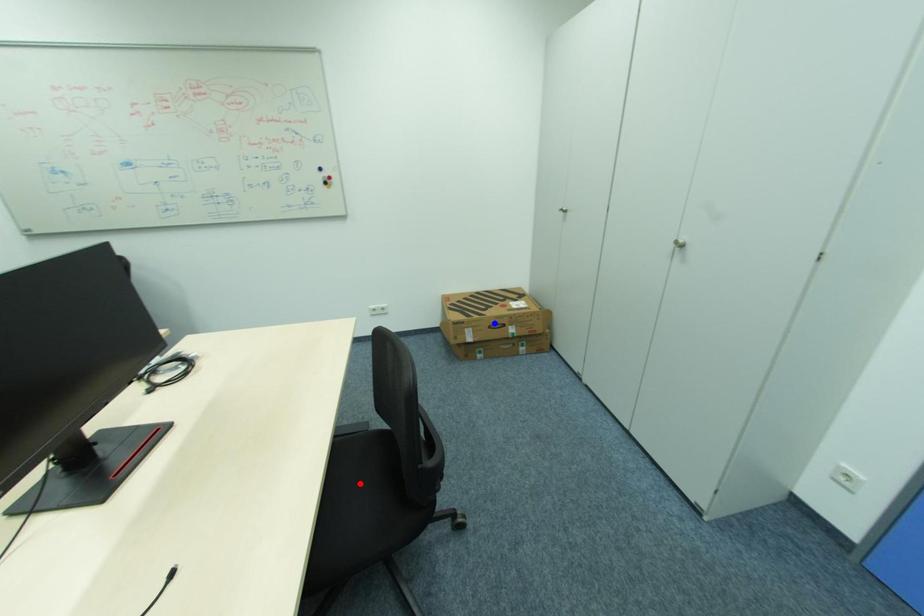
Question: In the image, two points are highlighted. Which point is nearer to the camera? Reply with the corresponding letter.

Choices:
 (A) blue point
 (B) red point

Answer: (B)